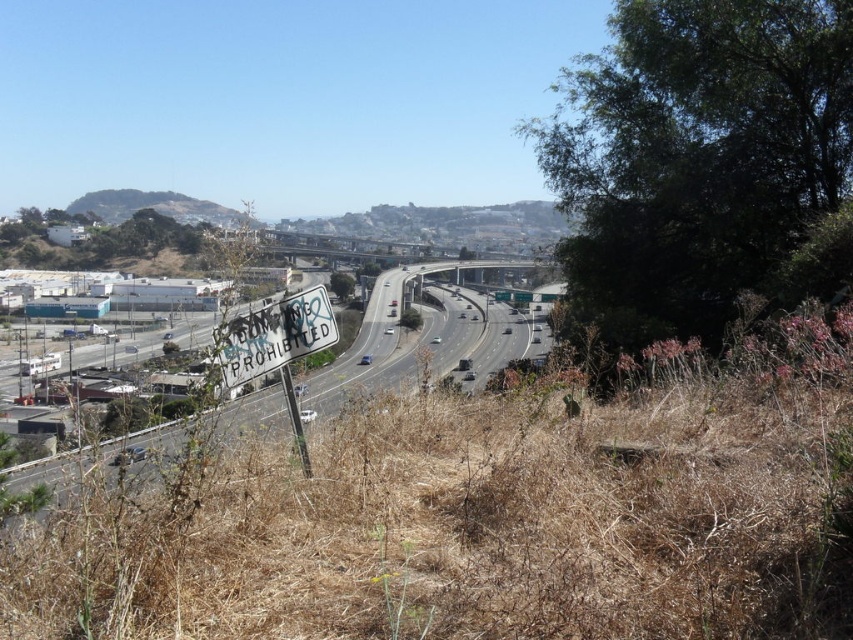
Question: Which point is farther to the camera?

Choices:
 (A) (167, 212)
 (B) (424, 314)

Answer: (A)

Question: Is white sign at center below green grassy hillside at upper left?

Choices:
 (A) no
 (B) yes

Answer: (B)

Question: Which point is closer to the camera taking this photo?

Choices:
 (A) (526, 328)
 (B) (126, 212)

Answer: (A)

Question: Which point is farther to the camera?

Choices:
 (A) green grassy hillside at upper left
 (B) white sign at center

Answer: (A)

Question: Is white sign at center above green grassy hillside at upper left?

Choices:
 (A) yes
 (B) no

Answer: (B)

Question: Is white sign at center smaller than green grassy hillside at upper left?

Choices:
 (A) yes
 (B) no

Answer: (B)